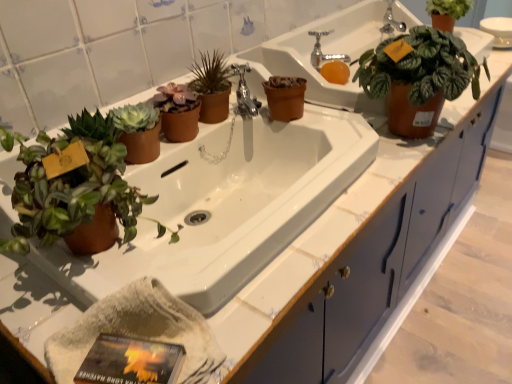
Describe the element at coordinates (447, 12) in the screenshot. I see `green matte plant at upper right, the 1th houseplant positioned from the back` at that location.

Describe the element at coordinates (130, 361) in the screenshot. I see `hardcover book at lower left` at that location.

Find the location of a particular element. The height and width of the screenshot is (384, 512). silver metallic faucet at upper center, the 1th faucet viewed from the top is located at coordinates (391, 21).

Image resolution: width=512 pixels, height=384 pixels. Identify the location of matte brown pot at left, placed as the 1th houseplant when sorted from left to right. 75,188.

This screenshot has width=512, height=384. Describe the element at coordinates (245, 92) in the screenshot. I see `polished chrome faucet at center` at that location.

You are a GUI agent. You are given a task and a screenshot of the screen. Output one action in this format:
    pyautogui.click(x=<x>, y=<y>)
    Task: Click on the matte brown pot at center, placed as the third houseplant when sorted from right to left
    The width and height of the screenshot is (512, 384).
    Given the screenshot: What is the action you would take?
    pyautogui.click(x=212, y=87)

Between matte brown pot at center, which is counted as the 2th houseplant, starting from the left, and polished chrome faucet at center, which one has less height?

With less height is polished chrome faucet at center.

In the image, is matte brown pot at center, which is counted as the 3th houseplant, starting from the front, on the left side or the right side of polished chrome faucet at center?

In the image, matte brown pot at center, which is counted as the 3th houseplant, starting from the front, appears on the left side of polished chrome faucet at center.

Which of these two, matte brown pot at center, which is counted as the 2th houseplant, starting from the left, or polished chrome faucet at center, is thinner?

matte brown pot at center, which is counted as the 2th houseplant, starting from the left.

Who is more distant, matte brown pot at left, marked as the 1th houseplant in a front-to-back arrangement, or matte brown pot at center, placed as the third houseplant when sorted from right to left?

matte brown pot at center, placed as the third houseplant when sorted from right to left, is more distant.

Considering the sizes of objects matte brown pot at left, marked as the 1th houseplant in a front-to-back arrangement, and matte brown pot at center, which is counted as the 2th houseplant, starting from the left, in the image provided, who is smaller, matte brown pot at left, marked as the 1th houseplant in a front-to-back arrangement, or matte brown pot at center, which is counted as the 2th houseplant, starting from the left,?

With smaller size is matte brown pot at center, which is counted as the 2th houseplant, starting from the left.

Measure the distance between matte brown pot at left, the 4th houseplant when ordered from back to front, and matte brown pot at center, which is counted as the 3th houseplant, starting from the front.

37.46 centimeters.

From the image's perspective, between matte brown pot at left, which is the fourth houseplant from right to left, and matte brown pot at center, the second houseplant from the back, who is located below?

matte brown pot at left, which is the fourth houseplant from right to left, is shown below in the image.

From the image's perspective, who appears lower, matte brown pot at left, the 4th houseplant when ordered from back to front, or matte brown pot at upper left?

matte brown pot at left, the 4th houseplant when ordered from back to front.

Is matte brown pot at left, placed as the 1th houseplant when sorted from left to right, looking in the opposite direction of matte brown pot at upper left?

No.

Is the position of matte brown pot at left, which is the fourth houseplant from right to left, more distant than that of matte brown pot at upper left?

No, matte brown pot at left, which is the fourth houseplant from right to left, is in front of matte brown pot at upper left.

Consider the image. Which of these two, matte brown pot at left, marked as the 1th houseplant in a front-to-back arrangement, or matte brown pot at upper left, is smaller?

With smaller size is matte brown pot at left, marked as the 1th houseplant in a front-to-back arrangement.

From a real-world perspective, is green matte plant at upper right, positioned as the 4th houseplant in left-to-right order, positioned under polished chrome faucet at center based on gravity?

No, from a real-world perspective, green matte plant at upper right, positioned as the 4th houseplant in left-to-right order, is not under polished chrome faucet at center.

Does point (440, 26) lie in front of point (242, 103)?

No.

Between green matte plant at upper right, the 1th houseplant positioned from the back, and polished chrome faucet at center, which one appears on the left side from the viewer's perspective?

Positioned to the left is polished chrome faucet at center.

Is green matte plant at upper right, placed as the fourth houseplant when sorted from front to back, further to the viewer compared to polished chrome faucet at center?

Yes, green matte plant at upper right, placed as the fourth houseplant when sorted from front to back, is behind polished chrome faucet at center.

Is polished chrome faucet at center not near silver metallic faucet at upper center, marked as the first faucet in a bottom-to-top arrangement?

No, there isn't a large distance between polished chrome faucet at center and silver metallic faucet at upper center, marked as the first faucet in a bottom-to-top arrangement.

The width and height of the screenshot is (512, 384). I want to click on the 1st faucet above when counting from the polished chrome faucet at center (from the image's perspective), so click(322, 53).

From a real-world perspective, which is physically below, polished chrome faucet at center or silver metallic faucet at upper center, which appears as the 2th faucet when viewed from the right?

polished chrome faucet at center is physically lower.

Is polished chrome faucet at center to the left of silver metallic faucet at upper center, which appears as the 2th faucet when viewed from the right, from the viewer's perspective?

Indeed, polished chrome faucet at center is positioned on the left side of silver metallic faucet at upper center, which appears as the 2th faucet when viewed from the right.

Is green matte plant at upper right, the 1th houseplant positioned from the back, completely or partially inside matte brown pot at left, the 4th houseplant when ordered from back to front?

No, green matte plant at upper right, the 1th houseplant positioned from the back, is not surrounded by matte brown pot at left, the 4th houseplant when ordered from back to front.

From a real-world perspective, is matte brown pot at left, which is the fourth houseplant from right to left, located higher than green matte plant at upper right, the 1th houseplant positioned from the back?

Correct, in the physical world, matte brown pot at left, which is the fourth houseplant from right to left, is higher than green matte plant at upper right, the 1th houseplant positioned from the back.

Which houseplant is the 3rd one when counting from the front of the green matte plant at upper right, placed as the fourth houseplant when sorted from front to back? Please provide its 2D coordinates.

[(75, 188)]

Does point (94, 126) come behind point (444, 4)?

No.

How many degrees apart are the facing directions of hardcover book at lower left and green matte plant at upper right, the first houseplant viewed from the right?

The angular difference between hardcover book at lower left and green matte plant at upper right, the first houseplant viewed from the right, is 29.1 degrees.

Is hardcover book at lower left surrounding green matte plant at upper right, placed as the fourth houseplant when sorted from front to back?

No, green matte plant at upper right, placed as the fourth houseplant when sorted from front to back, is not surrounded by hardcover book at lower left.

Is hardcover book at lower left facing towards green matte plant at upper right, positioned as the 4th houseplant in left-to-right order?

No, hardcover book at lower left is not turned towards green matte plant at upper right, positioned as the 4th houseplant in left-to-right order.

In the scene shown: In terms of height, does hardcover book at lower left look taller or shorter compared to green matte plant at upper right, positioned as the 4th houseplant in left-to-right order?

In the image, hardcover book at lower left appears to be shorter than green matte plant at upper right, positioned as the 4th houseplant in left-to-right order.

Find the location of `tap behind the matte brown pot at center, which is counted as the 3th houseplant, starting from the front`. tap behind the matte brown pot at center, which is counted as the 3th houseplant, starting from the front is located at coordinates (245, 92).

Image resolution: width=512 pixels, height=384 pixels. Identify the location of the 3rd houseplant located above the matte brown pot at center, which is counted as the 3th houseplant, starting from the front (from a real-world perspective). (75, 188).

Looking at the image, which one is located closer to polished chrome faucet at center, matte brown pot at left, placed as the 1th houseplant when sorted from left to right, or green matte plant at upper right, the second houseplant positioned from the front?

Based on the image, green matte plant at upper right, the second houseplant positioned from the front, appears to be nearer to polished chrome faucet at center.

From the image, which object appears to be farther from green matte plant at upper right, the second houseplant positioned from the front, matte brown pot at left, which is the fourth houseplant from right to left, or hardcover book at lower left?

The object further to green matte plant at upper right, the second houseplant positioned from the front, is hardcover book at lower left.

From the image, which object appears to be farther from green matte plant at upper right, the 2th houseplant in the right-to-left sequence, silver metallic faucet at upper center, marked as the 2th faucet in a top-to-bottom arrangement, or matte brown pot at center, placed as the third houseplant when sorted from right to left?

matte brown pot at center, placed as the third houseplant when sorted from right to left.

Which object lies further to the anchor point silver metallic faucet at upper center, which appears as the 2th faucet when viewed from the right, polished chrome faucet at center or green matte plant at upper right, the first houseplant viewed from the right?

Based on the image, polished chrome faucet at center appears to be further to silver metallic faucet at upper center, which appears as the 2th faucet when viewed from the right.

Which object lies nearer to the anchor point matte brown pot at upper left, polished chrome faucet at center or silver metallic faucet at upper center, the 1th faucet viewed from the top?

polished chrome faucet at center is positioned closer to the anchor matte brown pot at upper left.

Consider the image. Estimate the real-world distances between objects in this image. Which object is further from polished chrome faucet at center, matte brown pot at upper left or green matte plant at upper right, the 2th houseplant in the right-to-left sequence?

Based on the image, green matte plant at upper right, the 2th houseplant in the right-to-left sequence, appears to be further to polished chrome faucet at center.

Looking at the image, which one is located closer to green matte plant at upper right, the 1th houseplant positioned from the back, silver metallic faucet at upper center, the 2th faucet from the back, or matte brown pot at center, which is counted as the 2th houseplant, starting from the left?

Among the two, silver metallic faucet at upper center, the 2th faucet from the back, is located nearer to green matte plant at upper right, the 1th houseplant positioned from the back.

Estimate the real-world distances between objects in this image. Which object is further from silver metallic faucet at upper center, marked as the first faucet in a bottom-to-top arrangement, matte brown pot at upper left or green matte plant at upper right, which is the third houseplant from back to front?

The object further to silver metallic faucet at upper center, marked as the first faucet in a bottom-to-top arrangement, is matte brown pot at upper left.

The image size is (512, 384). I want to click on faucet located between matte brown pot at left, the 4th houseplant when ordered from back to front, and green matte plant at upper right, the first houseplant viewed from the right, in the depth direction, so 322,53.

Find the location of a particular element. The height and width of the screenshot is (384, 512). paperback book situated between matte brown pot at left, the 4th houseplant when ordered from back to front, and green matte plant at upper right, placed as the fourth houseplant when sorted from front to back, from left to right is located at coordinates (130, 361).

The width and height of the screenshot is (512, 384). Identify the location of faucet situated between polished chrome faucet at center and silver metallic faucet at upper center, which is the first faucet from right to left, from left to right. (322, 53).

Find the location of a particular element. The image size is (512, 384). faucet between green matte plant at upper right, the 2th houseplant in the right-to-left sequence, and silver metallic faucet at upper center, acting as the 2th faucet starting from the front, from front to back is located at coordinates (322, 53).